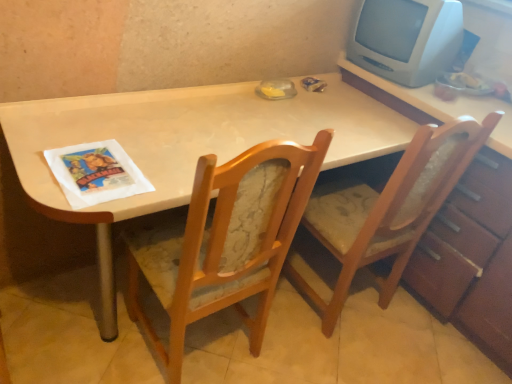
Question: Is white paper magazine at left to the right of wooden dresser at right from the viewer's perspective?

Choices:
 (A) yes
 (B) no

Answer: (B)

Question: Is wooden dresser at right located within white paper magazine at left?

Choices:
 (A) yes
 (B) no

Answer: (B)

Question: Is white paper magazine at left closer to camera compared to wooden dresser at right?

Choices:
 (A) no
 (B) yes

Answer: (B)

Question: From the image's perspective, is white paper magazine at left below wooden dresser at right?

Choices:
 (A) yes
 (B) no

Answer: (B)

Question: Does white paper magazine at left have a lesser height compared to wooden dresser at right?

Choices:
 (A) yes
 (B) no

Answer: (A)

Question: From the image's perspective, is white plastic monitor at upper right above or below wooden textured chair at right, acting as the 1th chair starting from the right?

Choices:
 (A) below
 (B) above

Answer: (B)

Question: Is white plastic monitor at upper right taller or shorter than wooden textured chair at right, which is the second chair from left to right?

Choices:
 (A) short
 (B) tall

Answer: (A)

Question: Based on their sizes in the image, would you say white plastic monitor at upper right is bigger or smaller than wooden textured chair at right, which is the second chair from left to right?

Choices:
 (A) big
 (B) small

Answer: (B)

Question: In terms of width, does white plastic monitor at upper right look wider or thinner when compared to wooden textured chair at right, acting as the 1th chair starting from the right?

Choices:
 (A) wide
 (B) thin

Answer: (B)

Question: In terms of size, does wooden textured chair at right, which is the second chair from left to right, appear bigger or smaller than wooden table at center?

Choices:
 (A) big
 (B) small

Answer: (B)

Question: Is wooden textured chair at right, which is the second chair from left to right, wider or thinner than wooden table at center?

Choices:
 (A) wide
 (B) thin

Answer: (B)

Question: In terms of height, does wooden textured chair at right, which is the second chair from left to right, look taller or shorter compared to wooden table at center?

Choices:
 (A) short
 (B) tall

Answer: (B)

Question: From a real-world perspective, relative to wooden table at center, is wooden textured chair at right, acting as the 1th chair starting from the right, vertically above or below?

Choices:
 (A) below
 (B) above

Answer: (B)

Question: Is point (117, 172) closer or farther from the camera than point (67, 132)?

Choices:
 (A) farther
 (B) closer

Answer: (B)

Question: Is white paper magazine at left to the left or to the right of wooden table at center in the image?

Choices:
 (A) right
 (B) left

Answer: (B)